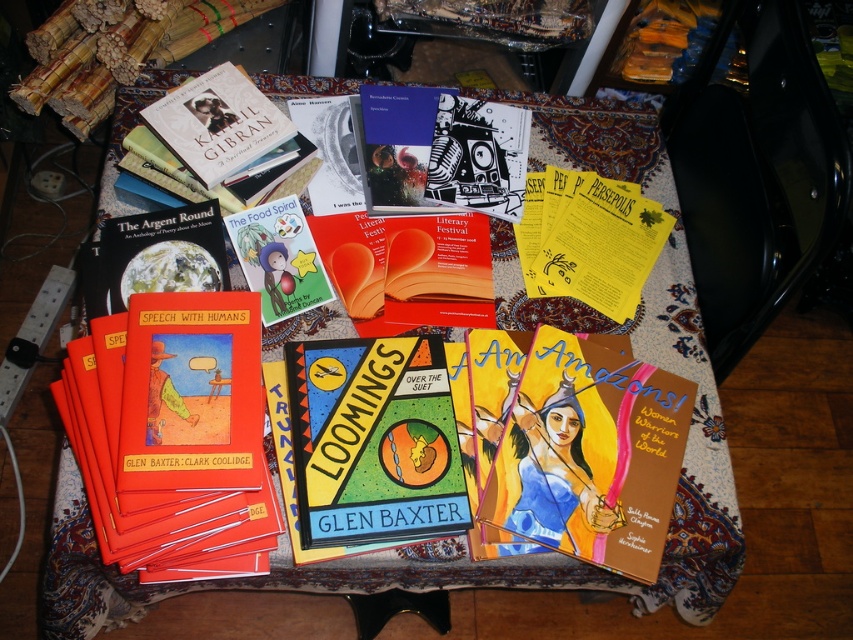
Who is more forward, (178, 428) or (219, 456)?

Positioned in front is point (219, 456).

Can you confirm if red matte book at lower left is shorter than red matte book at center?

No, red matte book at lower left is not shorter than red matte book at center.

This screenshot has width=853, height=640. What do you see at coordinates (184, 416) in the screenshot?
I see `red matte book at lower left` at bounding box center [184, 416].

Find the location of a particular element. Image resolution: width=853 pixels, height=640 pixels. red matte book at lower left is located at coordinates (184, 416).

Does point (247, 417) come in front of point (466, 296)?

Yes, point (247, 417) is closer to viewer.

Who is more forward, (x=207, y=483) or (x=335, y=264)?

Point (x=207, y=483)

Where is `red matte book at lower left`? red matte book at lower left is located at coordinates (184, 416).

Is hardcover book at center wider than matte black book at upper left?

Indeed, hardcover book at center has a greater width compared to matte black book at upper left.

Does hardcover book at center have a greater height compared to matte black book at upper left?

Correct, hardcover book at center is much taller as matte black book at upper left.

Is point (405, 413) closer to viewer compared to point (196, 225)?

Yes, point (405, 413) is closer to viewer.

This screenshot has width=853, height=640. Find the location of `hardcover book at center`. hardcover book at center is located at coordinates (374, 440).